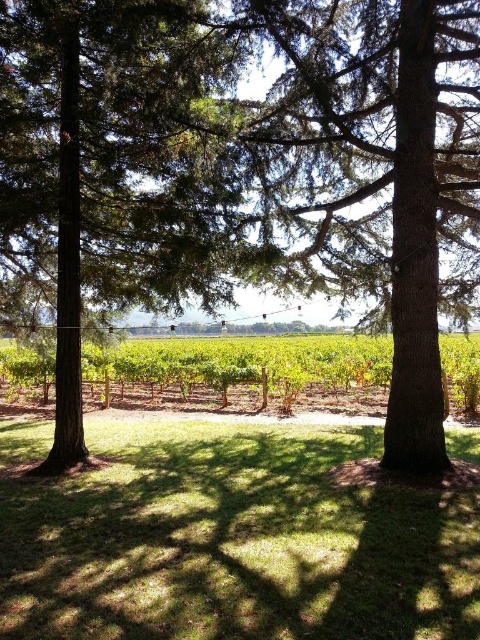
Question: Is green grass at center to the left of green textured tree at center from the viewer's perspective?

Choices:
 (A) no
 (B) yes

Answer: (A)

Question: Can you confirm if green grass at center is smaller than green textured tree at center?

Choices:
 (A) no
 (B) yes

Answer: (B)

Question: Which object appears closest to the camera in this image?

Choices:
 (A) green textured tree at center
 (B) green grass at center

Answer: (B)

Question: Can you confirm if green grass at center is positioned above green textured tree at center?

Choices:
 (A) yes
 (B) no

Answer: (B)